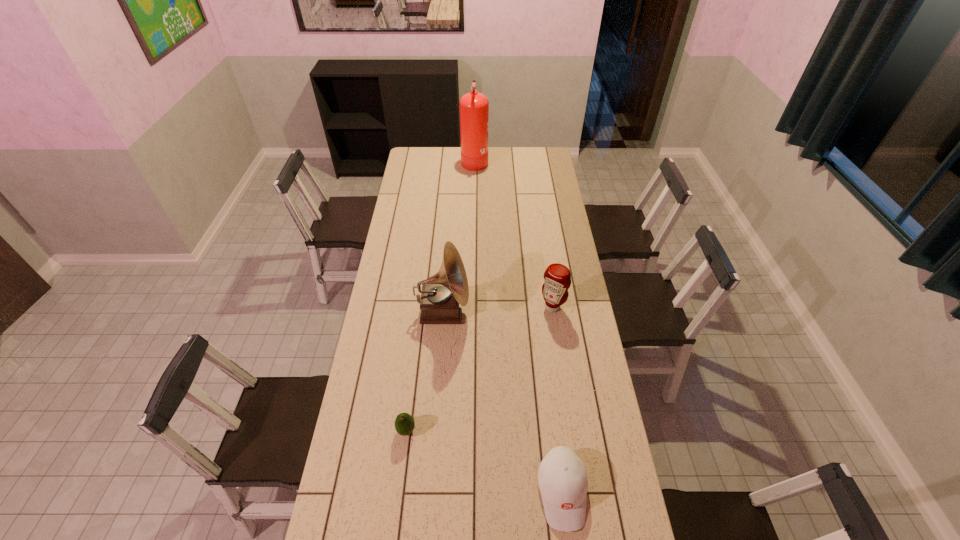
Where is `fire extinguisher`? fire extinguisher is located at coordinates (474, 107).

The width and height of the screenshot is (960, 540). Identify the location of the farthest object. (474, 107).

The image size is (960, 540). I want to click on phonograph record, so click(x=442, y=296).

I want to click on the third tallest object, so click(557, 278).

Locate an element on the screen. Image resolution: width=960 pixels, height=540 pixels. baseball cap is located at coordinates (562, 478).

Identify the location of avocado. (404, 423).

Find the location of a particular element. vacant area situated towards the nozzle of the tallest object is located at coordinates (534, 160).

Image resolution: width=960 pixels, height=540 pixels. Identify the location of vacant space situated 0.310m on the horn of the second tallest object. (542, 312).

This screenshot has height=540, width=960. In order to click on blank space located on the left of the condiment in this screenshot , I will do `click(505, 307)`.

You are a GUI agent. You are given a task and a screenshot of the screen. Output one action in this format:
    pyautogui.click(x=<x>, y=<y>)
    Task: Click on the free location located on the back of the second nearest object
    The image size is (960, 540).
    Given the screenshot: What is the action you would take?
    pyautogui.click(x=416, y=349)